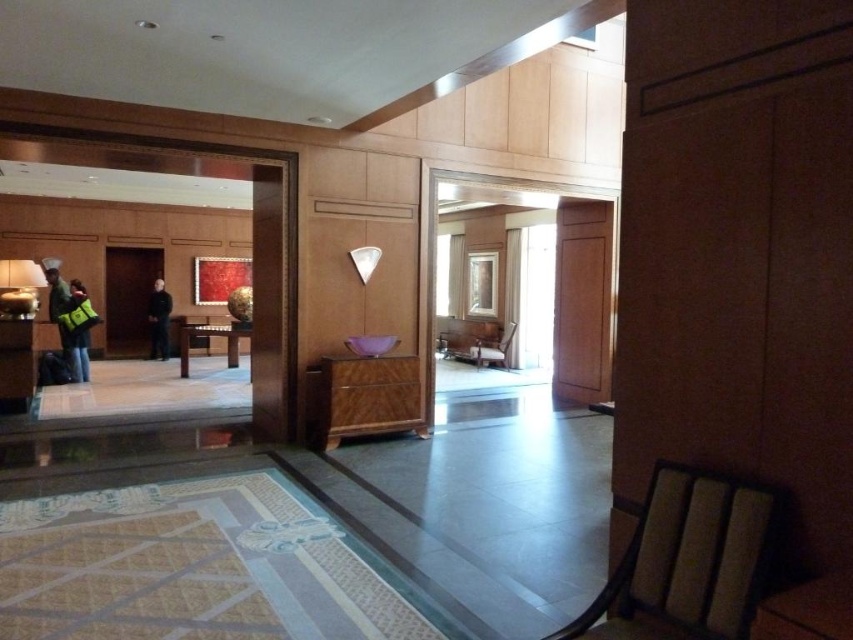
You are standing in the lobby and need to retrieve both the reflective green jacket at left and the black matte jacket at center. Which jacket should you pick up first if you want to start with the one closer to the floor?

The reflective green jacket at left is located below the black matte jacket at center, so you should pick up the reflective green jacket at left first since it is closer to the floor.